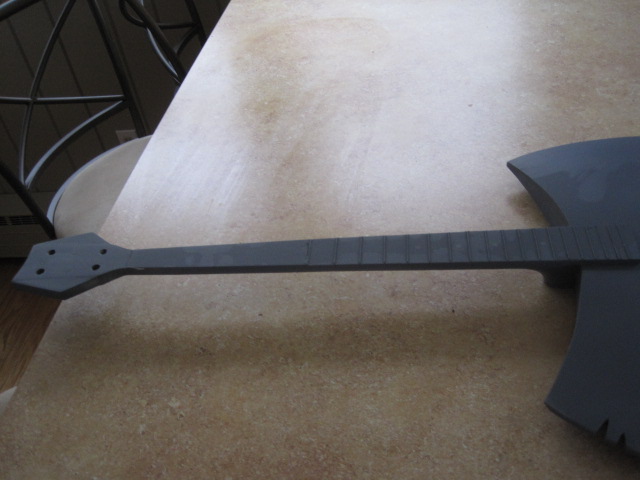
Where is `wall`? This screenshot has height=480, width=640. wall is located at coordinates (141, 74).